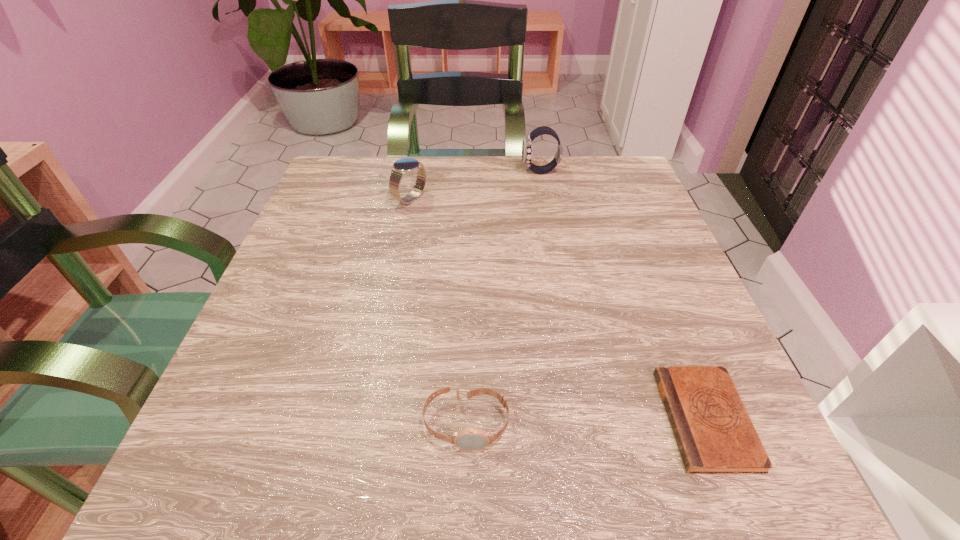
At what (x,y) coordinates should I click in order to perform the action: click on the rightmost watch. Please return your answer as a coordinate pair (x, y). The width and height of the screenshot is (960, 540). Looking at the image, I should click on 527,148.

At what (x,y) coordinates should I click in order to perform the action: click on the tallest watch. Please return your answer as a coordinate pair (x, y). This screenshot has width=960, height=540. Looking at the image, I should click on (527, 148).

Where is `the second shortest watch`? the second shortest watch is located at coordinates (403, 167).

You are a GUI agent. You are given a task and a screenshot of the screen. Output one action in this format:
    pyautogui.click(x=<x>, y=<y>)
    Task: Click on the third nearest object
    The height and width of the screenshot is (540, 960).
    Given the screenshot: What is the action you would take?
    pyautogui.click(x=403, y=167)

Locate an element on the screen. The height and width of the screenshot is (540, 960). the second shortest object is located at coordinates (471, 438).

Where is `the second watch from right to left`? the second watch from right to left is located at coordinates (471, 438).

The image size is (960, 540). I want to click on the rightmost object, so click(714, 433).

The image size is (960, 540). What are the coordinates of `the shortest object` in the screenshot? It's located at (x=714, y=433).

Identify the location of vacant area situated 0.220m on the face of the rightmost watch. (431, 172).

The width and height of the screenshot is (960, 540). I want to click on vacant region located on the face of the rightmost watch, so click(357, 172).